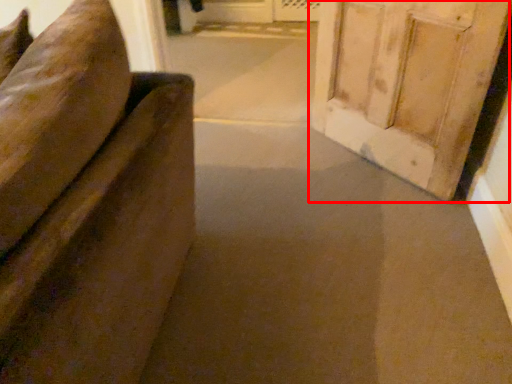
Question: From the image's perspective, considering the relative positions of door (annotated by the red box) and passage in the image provided, where is door (annotated by the red box) located with respect to the staircase?

Choices:
 (A) below
 (B) above

Answer: (A)